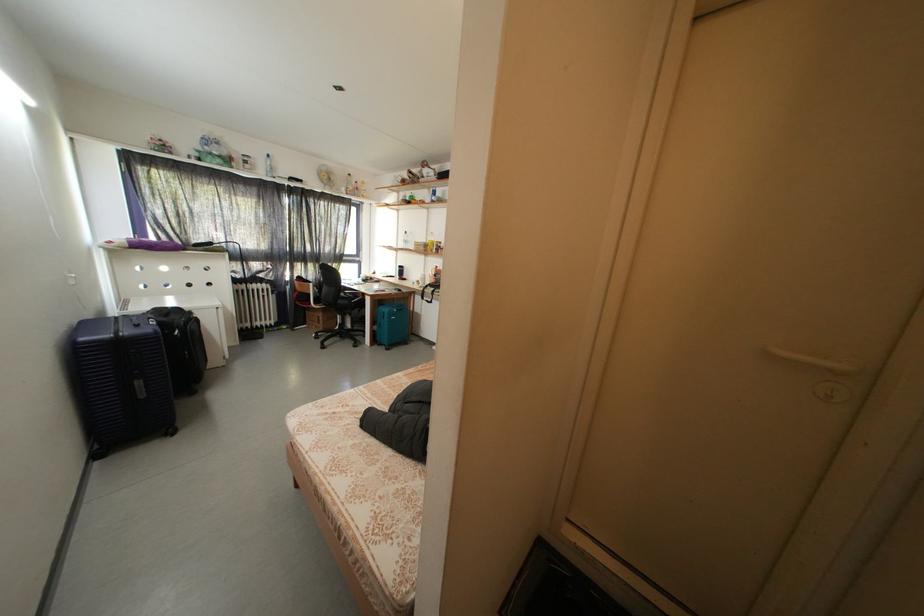
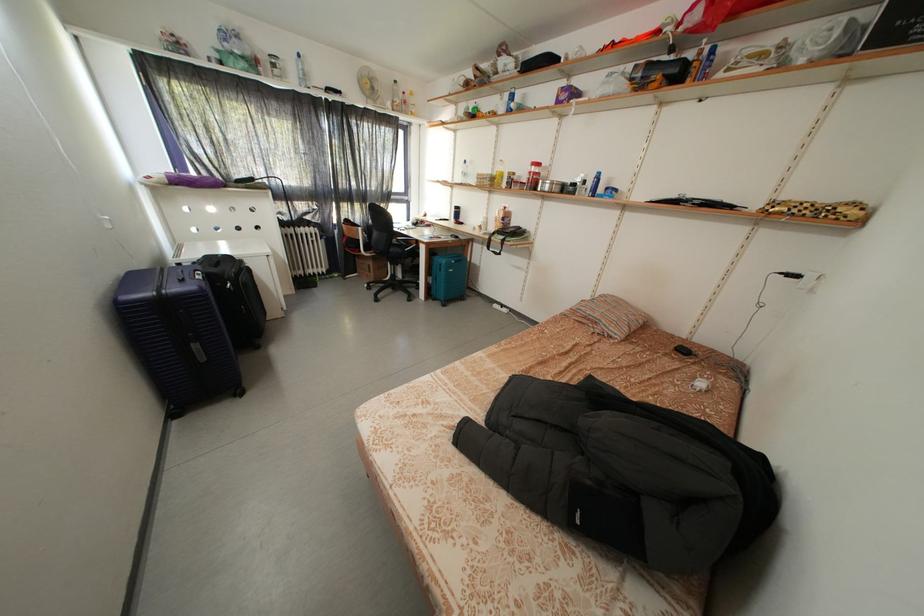
Find the pixel in the second image that matches [151,400] in the first image.

(211, 363)